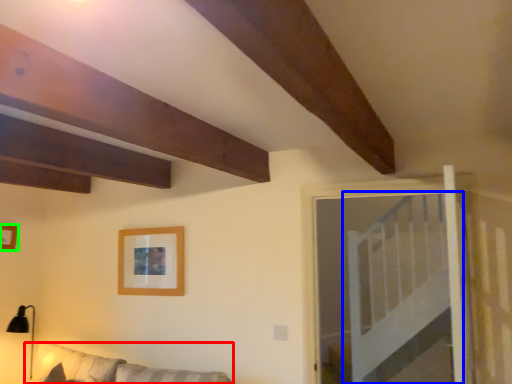
Question: Which is farther away from couch (highlighted by a red box)? bed (highlighted by a blue box) or picture frame (highlighted by a green box)?

Choices:
 (A) bed
 (B) picture frame

Answer: (A)